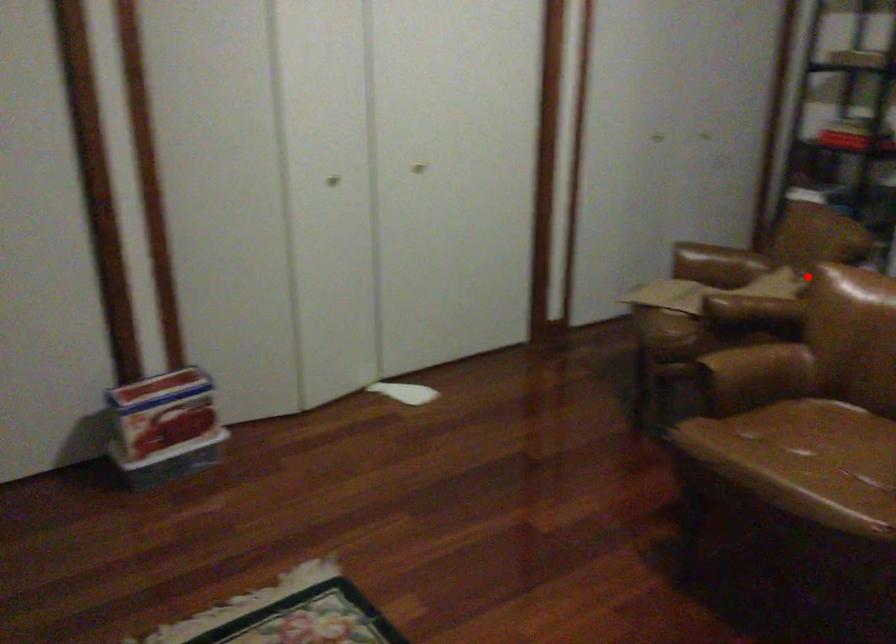
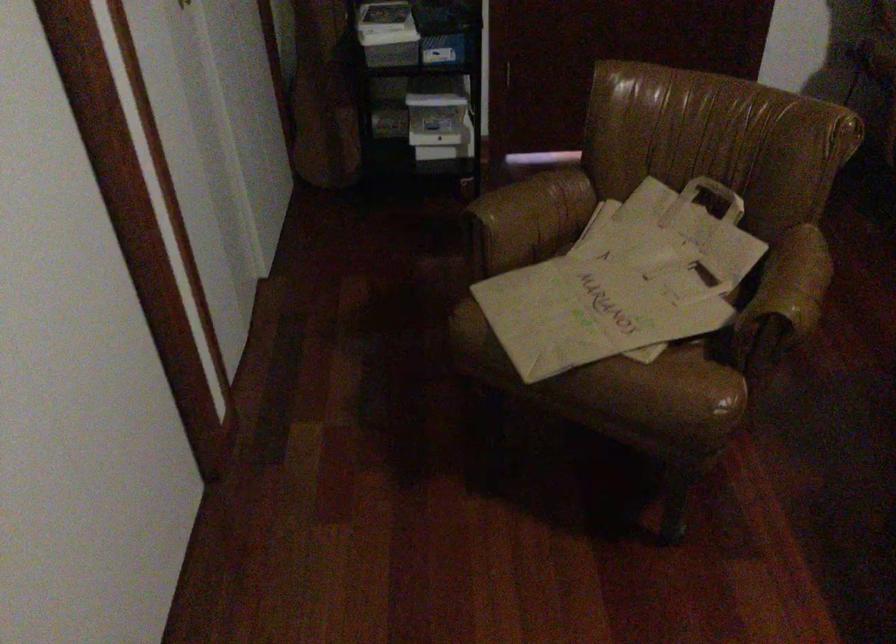
Question: I am providing you with two images of the same scene from different viewpoints. Given a red point in image1, look at the same physical point in image2. Is it:

Choices:
 (A) Closer to the viewpoint
 (B) Farther from the viewpoint

Answer: (A)